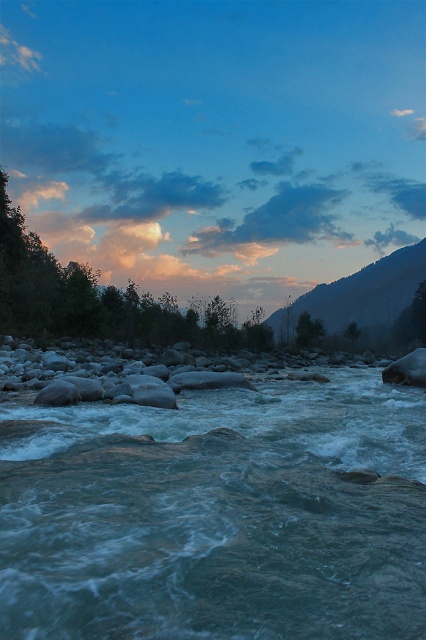
From the picture: Can you confirm if translucent blue water at center is smaller than rocky mountain at upper right?

Correct, translucent blue water at center occupies less space than rocky mountain at upper right.

Which is more to the right, translucent blue water at center or rocky mountain at upper right?

rocky mountain at upper right

In order to click on translucent blue water at center in this screenshot , I will do `click(218, 515)`.

In order to click on translucent blue water at center in this screenshot , I will do `click(218, 515)`.